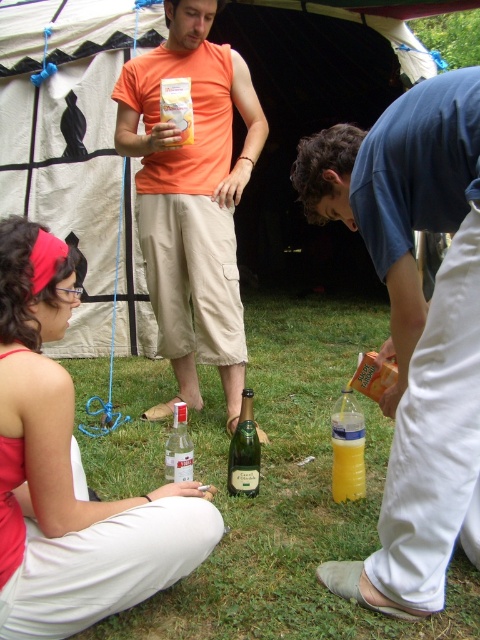
Question: Among these objects, which one is farthest from the camera?

Choices:
 (A) matte red bandana at lower left
 (B) translucent plastic bottle at lower center
 (C) white canvas tent at upper center
 (D) green glass bottle at center

Answer: (C)

Question: Does white canvas tent at upper center appear on the left side of blue cotton shirt at center?

Choices:
 (A) no
 (B) yes

Answer: (B)

Question: Is blue cotton shirt at center below green glass bottle at center?

Choices:
 (A) no
 (B) yes

Answer: (A)

Question: Which of the following is the farthest from the observer?

Choices:
 (A) (182, 403)
 (B) (410, 497)
 (C) (227, 10)
 (D) (21, 248)

Answer: (C)

Question: Observing the image, what is the correct spatial positioning of blue cotton shirt at center in reference to translucent plastic bottle at lower center?

Choices:
 (A) left
 (B) right

Answer: (B)

Question: Which of the following is the farthest from the observer?

Choices:
 (A) (373, 157)
 (B) (253, 493)
 (C) (348, 435)
 (D) (237, 77)

Answer: (D)